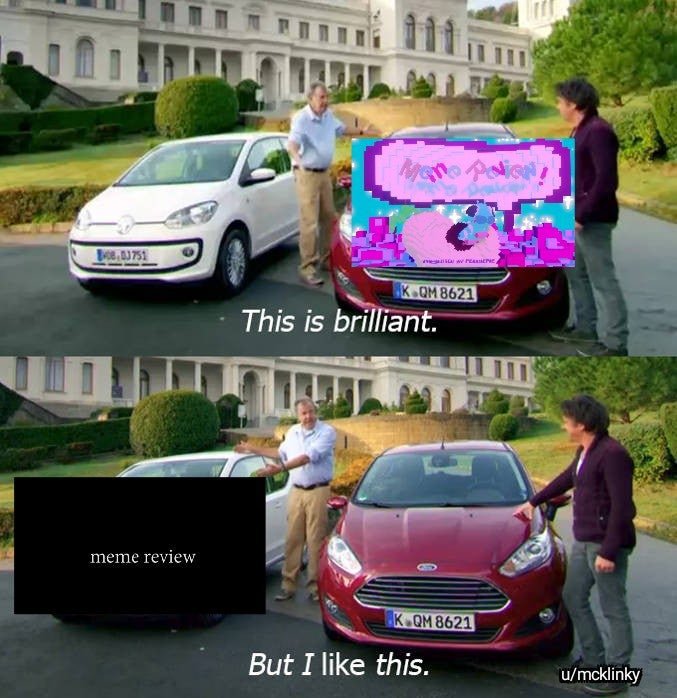
Where is `doorway`? doorway is located at coordinates (250, 394), (263, 84).